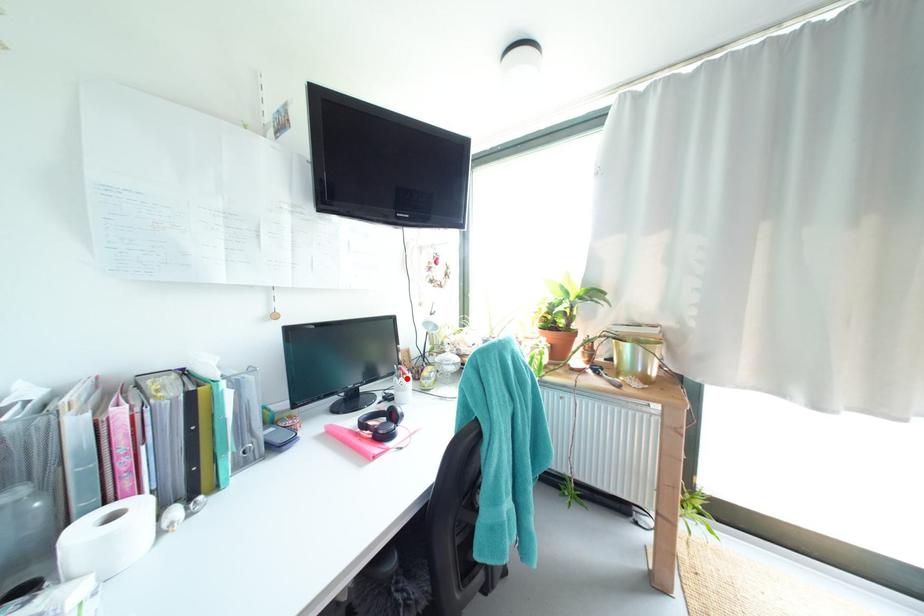
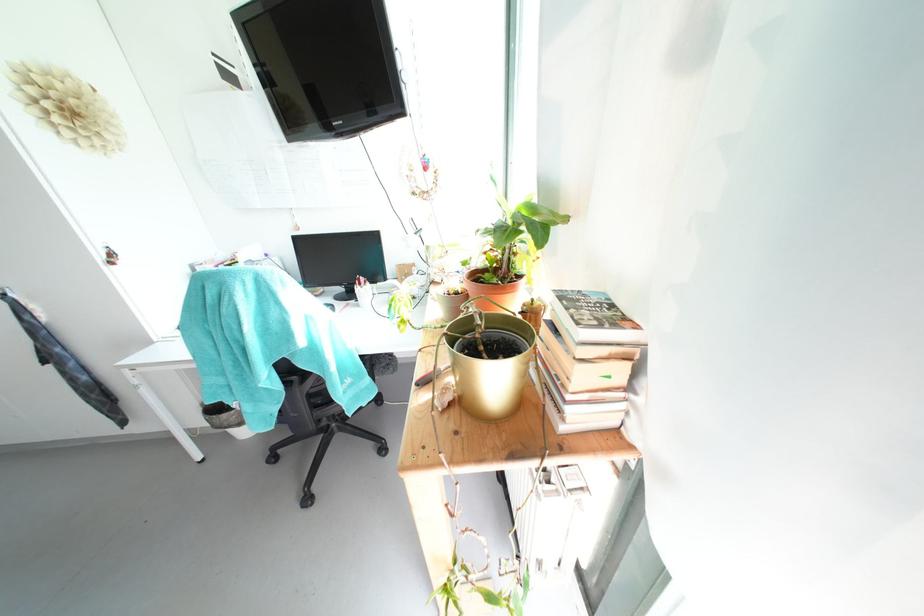
Question: A red point is marked in image1. In image2, is the corresponding 3D point closer to the camera or farther? Reply with the corresponding letter.

Choices:
 (A) The corresponding 3D point is closer.
 (B) The corresponding 3D point is farther.

Answer: (B)